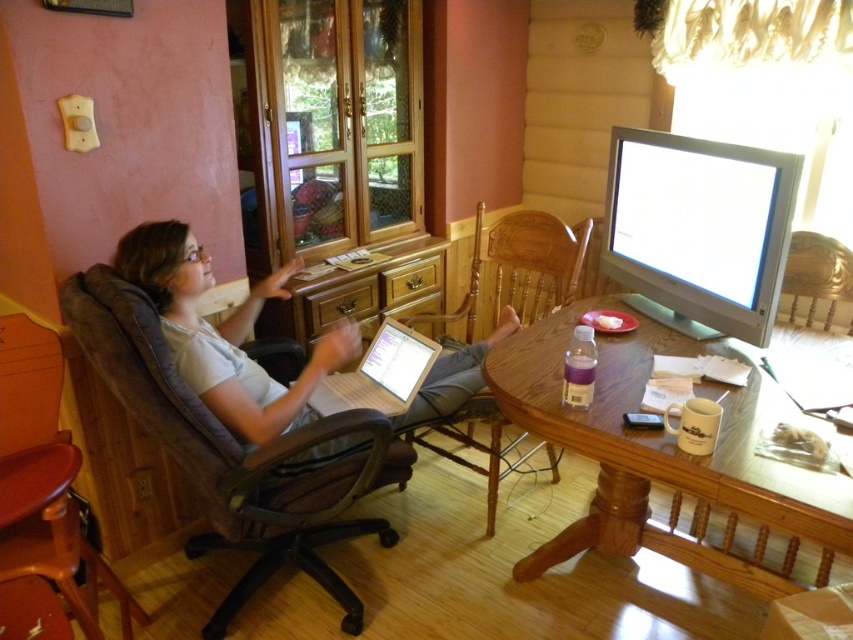
Does wooden table at center appear under brown wood chair at center?

Yes, wooden table at center is below brown wood chair at center.

Can you confirm if wooden table at center is shorter than brown wood chair at center?

Correct, wooden table at center is not as tall as brown wood chair at center.

This screenshot has height=640, width=853. In order to click on wooden table at center in this screenshot , I will do `click(669, 460)`.

Which of these two, matte gray laptop at center or wooden swivel chair at left, stands shorter?

matte gray laptop at center is shorter.

Is matte gray laptop at center positioned before wooden swivel chair at left?

No, it is not.

I want to click on matte gray laptop at center, so click(225, 333).

Where is `matte gray laptop at center`? matte gray laptop at center is located at coordinates (225, 333).

Does point (323, 504) come in front of point (498, 275)?

Yes, it is.

Is point (250, 468) less distant than point (503, 275)?

That is True.

In order to click on brown leather swivel chair at left in this screenshot , I will do `click(230, 452)`.